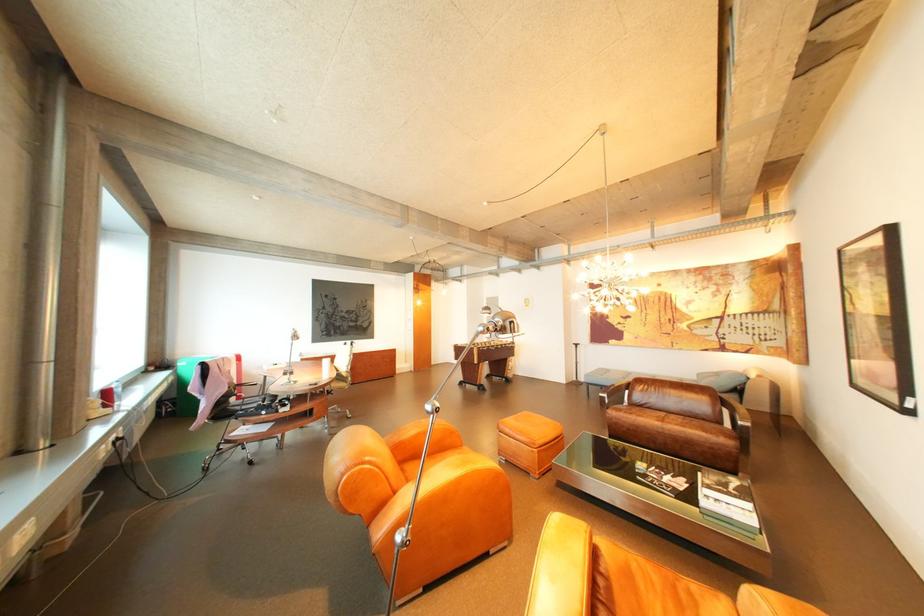
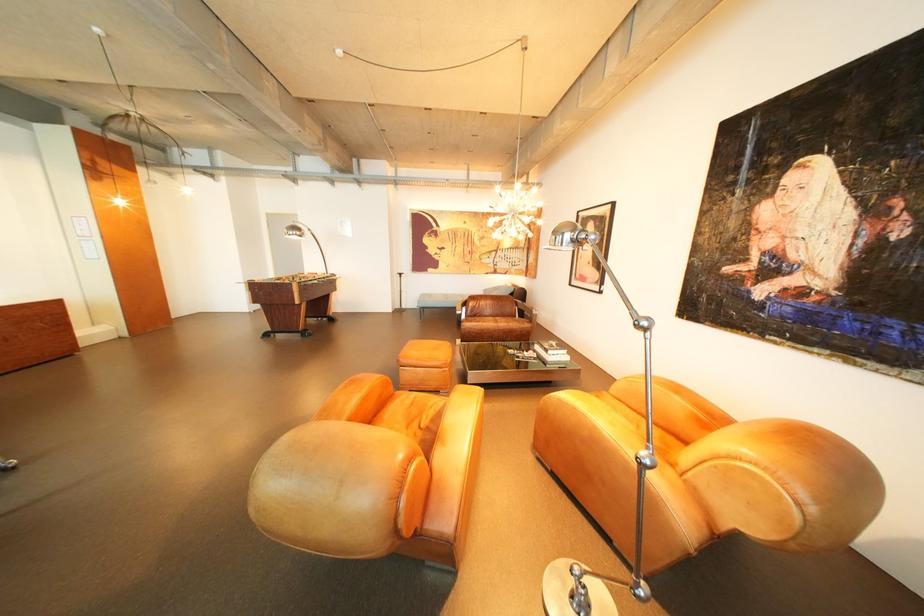
In the second image, find the point that corresponds to pixel 816 314 in the first image.

(552, 249)